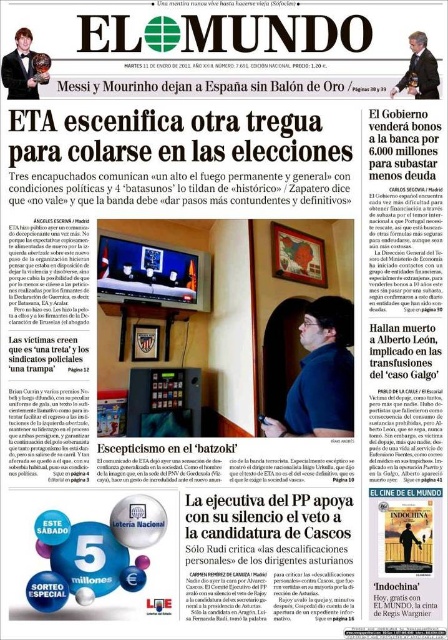
Question: Is black plastic phone at center positioned behind suit at upper right?

Choices:
 (A) yes
 (B) no

Answer: (B)

Question: Which object is positioned farthest from the shiny black tuxedo at upper left?

Choices:
 (A) suit at upper right
 (B) black plastic phone at center

Answer: (A)

Question: Is the position of shiny black tuxedo at upper left more distant than that of suit at upper right?

Choices:
 (A) yes
 (B) no

Answer: (B)

Question: Estimate the real-world distances between objects in this image. Which object is farther from the black plastic phone at center?

Choices:
 (A) suit at upper right
 (B) shiny black tuxedo at upper left

Answer: (B)

Question: Does shiny black tuxedo at upper left have a lesser width compared to suit at upper right?

Choices:
 (A) no
 (B) yes

Answer: (B)

Question: Which object is closer to the camera taking this photo?

Choices:
 (A) black plastic phone at center
 (B) suit at upper right
 (C) shiny black tuxedo at upper left

Answer: (A)